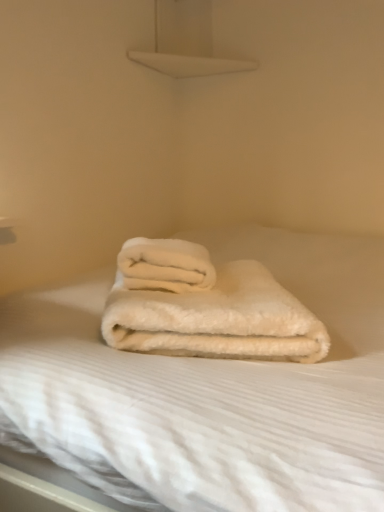
Question: In terms of size, does white fluffy towel at center, which is counted as the 1th towel, starting from the bottom, appear bigger or smaller than white fluffy towel at center, the 2th towel positioned from the bottom?

Choices:
 (A) big
 (B) small

Answer: (A)

Question: From the image's perspective, is white fluffy towel at center, which is counted as the 1th towel, starting from the bottom, positioned above or below white fluffy towel at center, which is counted as the 1th towel, starting from the top?

Choices:
 (A) above
 (B) below

Answer: (B)

Question: Which of these objects is positioned closest to the white fluffy towel at center, the 2th towel positioned from the bottom?

Choices:
 (A) white fluffy towel at center, which is counted as the 1th towel, starting from the bottom
 (B) white fluffy blanket at center

Answer: (A)

Question: Which object is the closest to the white fluffy towel at center, which is counted as the 1th towel, starting from the top?

Choices:
 (A) white fluffy towel at center, which is counted as the 1th towel, starting from the bottom
 (B) white fluffy blanket at center

Answer: (A)